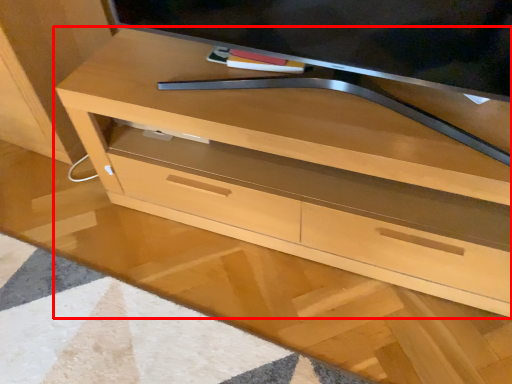
Question: In this image, where is chest of drawers (annotated by the red box) located relative to television?

Choices:
 (A) left
 (B) right

Answer: (B)